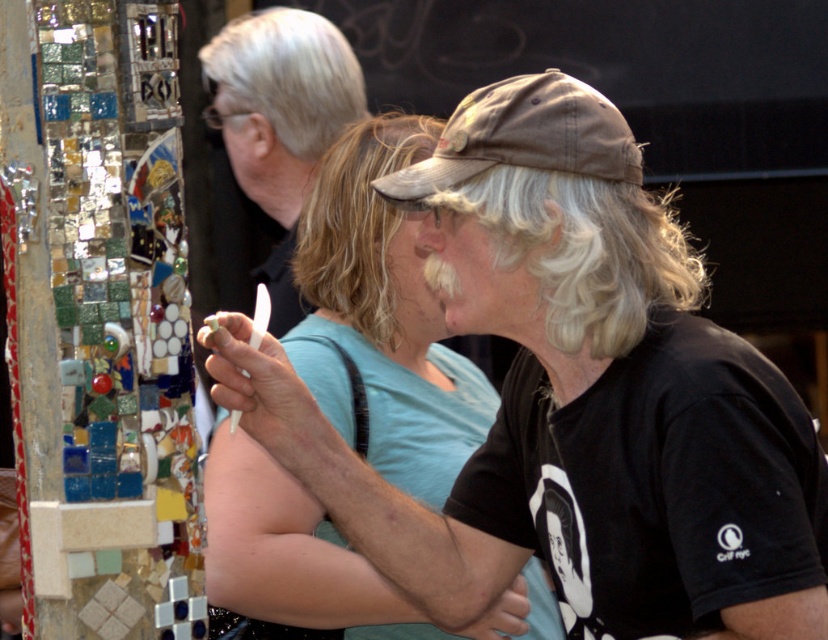
You are a photographer trying to capture a clear shot of the light blue cotton shirt at center and the white matte cap at upper center. Which object should you focus on first if you want to ensure both are in focus?

The light blue cotton shirt at center is positioned under the white matte cap at upper center, so you should focus on the white matte cap at upper center first to ensure both are in focus.

You are a photographer trying to capture a photo of the light blue cotton shirt at center and the white matte cap at upper center. If your camera can focus on objects within 5 feet of each other, will both items be in focus?

The light blue cotton shirt at center is 7.27 feet from the white matte cap at upper center. Since the distance between them exceeds the 5 feet focus range, they cannot both be in focus simultaneously.

You are standing at point A located at coordinates point A at [220,502]. You want to walk to point B which is 4.26 meters away from you. Which direction should you walk to reach point B?

Since the distance between point A at [220,502] and point B is 4.26 meters, you should walk in the direction away from the person on the right wearing a black T shirt with a graphic design and a beige baseball cap to reach point B.